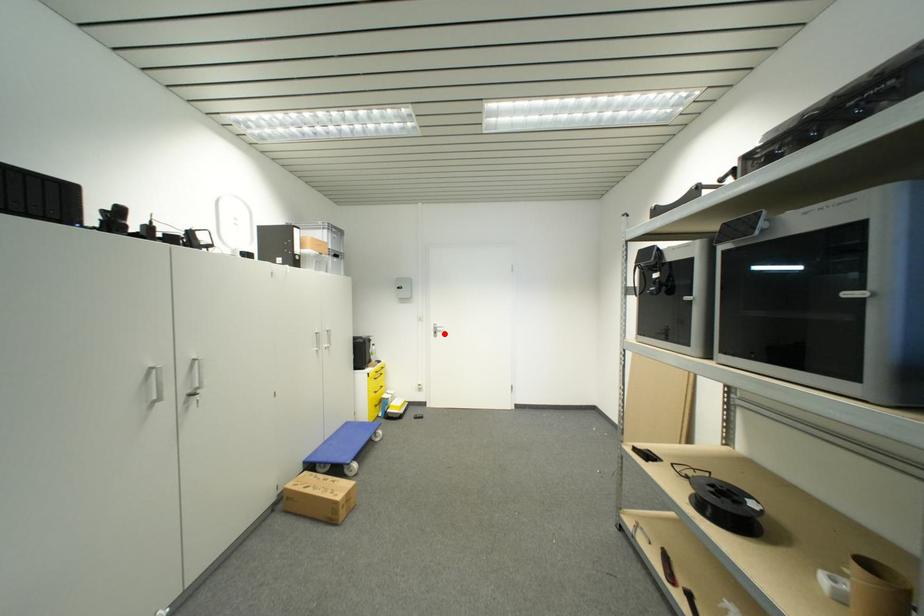
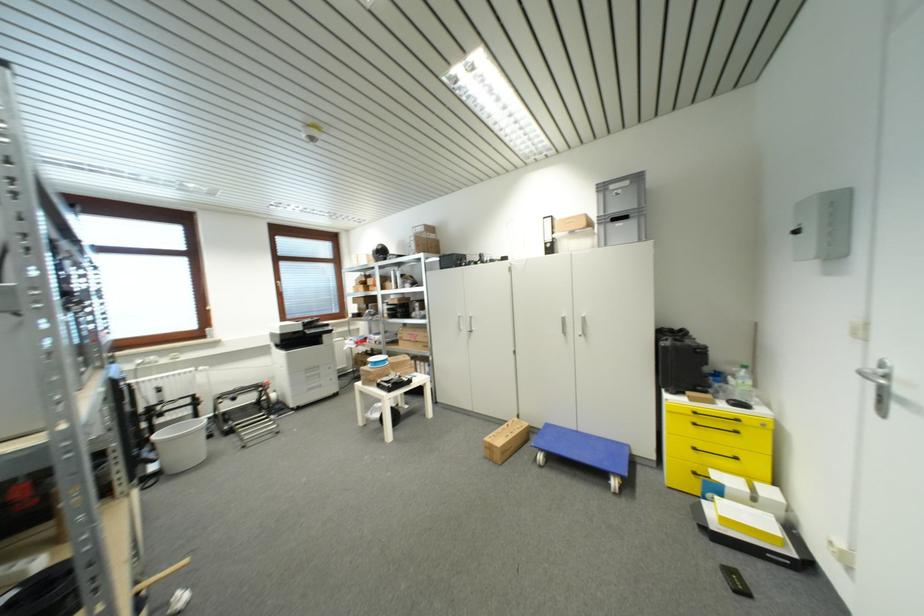
The point at the highlighted location is marked in the first image. Where is the corresponding point in the second image?

(909, 405)